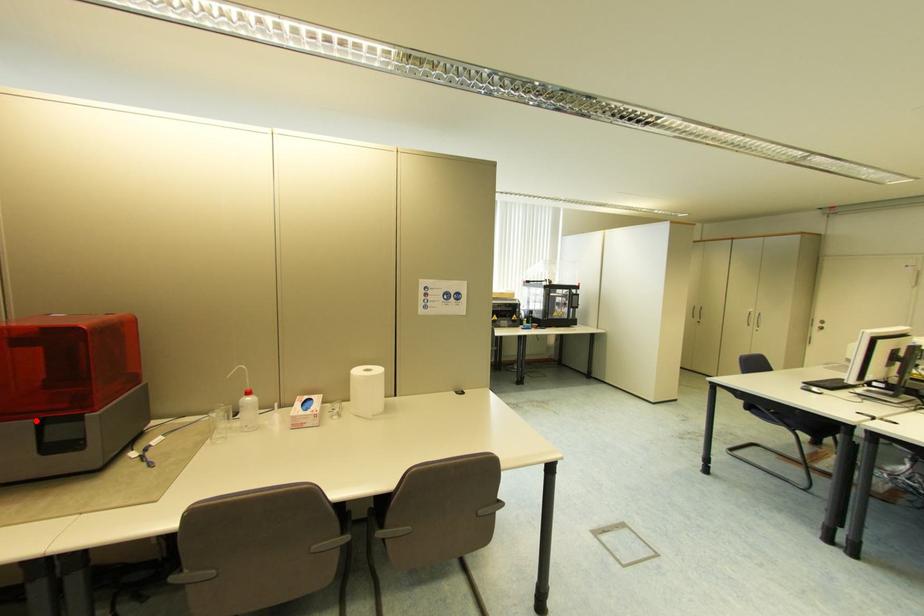
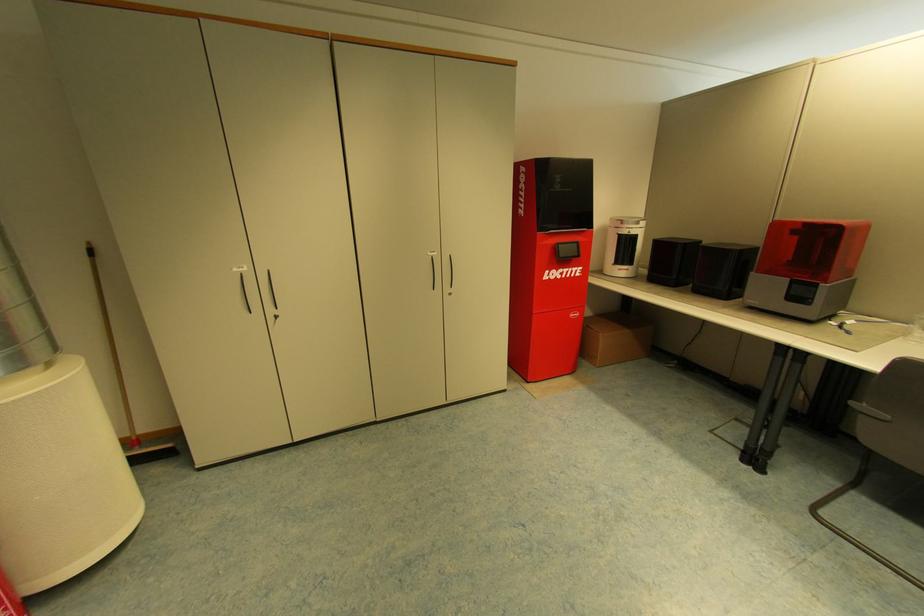
Question: I am providing you with two images of the same scene from different viewpoints. In image1, a red point is highlighted. Considering the same 3D point in image2, which of the following is correct?

Choices:
 (A) It is closer
 (B) It is farther

Answer: (B)